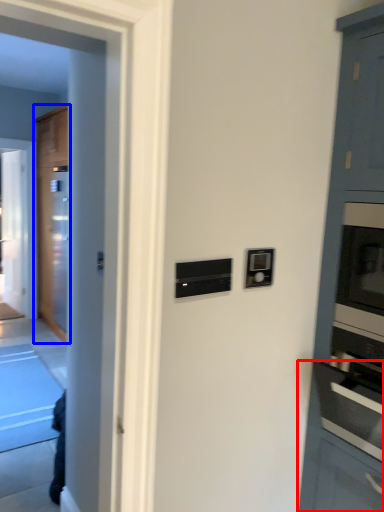
Question: Which object is closer to the camera taking this photo, cabinetry (highlighted by a red box) or door (highlighted by a blue box)?

Choices:
 (A) cabinetry
 (B) door

Answer: (A)